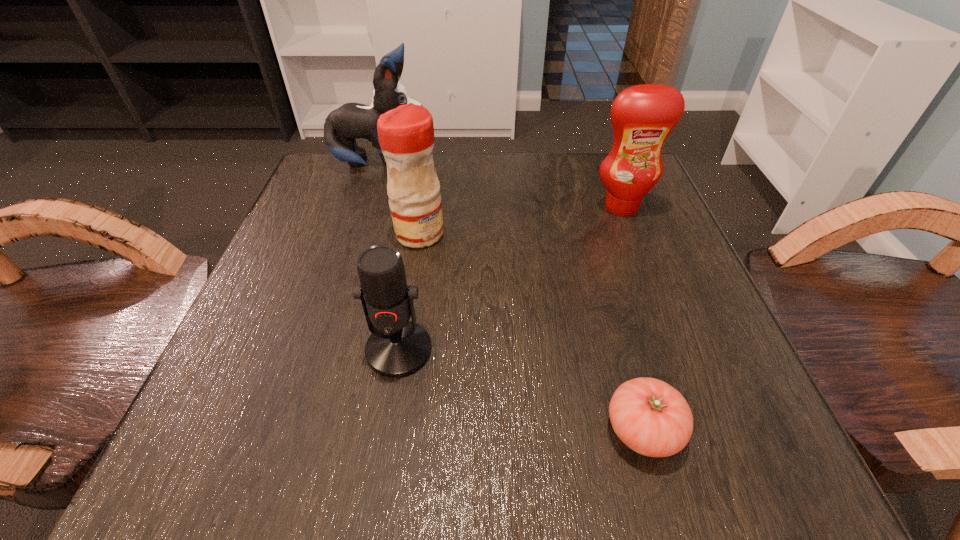
I want to click on empty space that is in between the tomato and the farther condiment, so click(x=633, y=318).

The image size is (960, 540). I want to click on free space between the fourth tallest object and the tomato, so [x=521, y=389].

Find the location of a particular element. This screenshot has height=540, width=960. blank region between the nearest object and the farther condiment is located at coordinates (633, 318).

The image size is (960, 540). I want to click on free space between the nearest object and the second nearest object, so click(521, 389).

Where is `free space between the nearer condiment and the nearest object`? The width and height of the screenshot is (960, 540). free space between the nearer condiment and the nearest object is located at coordinates (531, 332).

Image resolution: width=960 pixels, height=540 pixels. Find the location of `object that ranks as the fourth closest to the farthest object`. object that ranks as the fourth closest to the farthest object is located at coordinates (652, 418).

Find the location of a particular element. This screenshot has height=540, width=960. the fourth closest object to the nearest object is located at coordinates (351, 121).

The height and width of the screenshot is (540, 960). Identify the location of free region that satisfies the following two spatial constraints: 1. on the front-facing side of the tomato; 2. on the right side of the puppy. (298, 429).

Find the location of a particular element. The image size is (960, 540). free space that satisfies the following two spatial constraints: 1. on the front-facing side of the puppy; 2. on the left side of the shortest object is located at coordinates (298, 429).